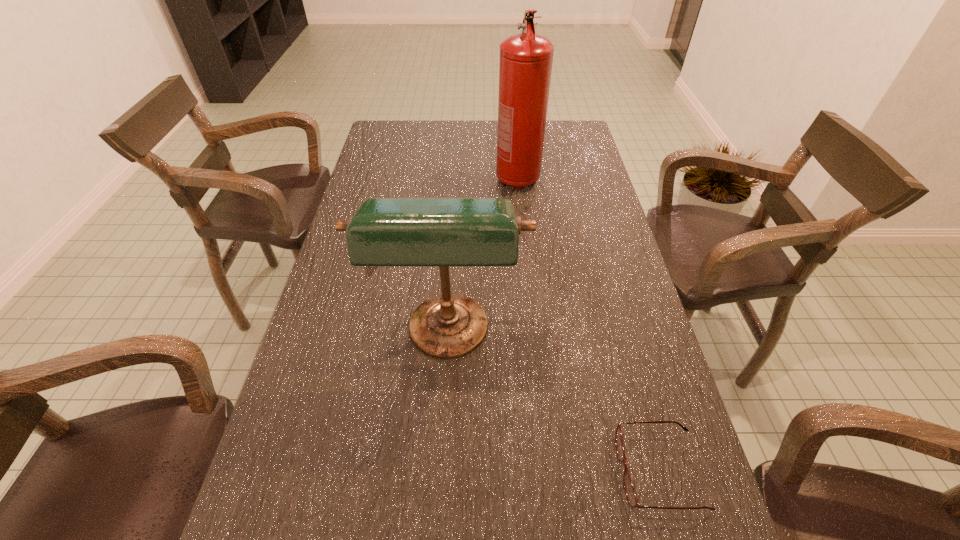
Find the location of a particular element. free location located 0.100m on the lenses of the nearest object is located at coordinates (566, 471).

What are the coordinates of `object that is positioned at the left edge` in the screenshot? It's located at (443, 232).

Find the location of `object located in the right edge section of the desktop`. object located in the right edge section of the desktop is located at coordinates (630, 492).

In the image, there is a desktop. Identify the location of vacant space at the far edge. Image resolution: width=960 pixels, height=540 pixels. (441, 144).

In the image, there is a desktop. Identify the location of free region at the left edge. (381, 185).

Locate an element on the screen. This screenshot has height=540, width=960. vacant space at the right edge is located at coordinates (683, 492).

Locate an element on the screen. vacant area between the second tallest object and the rightmost object is located at coordinates pyautogui.click(x=554, y=403).

The width and height of the screenshot is (960, 540). Identify the location of empty space that is in between the rightmost object and the second tallest object. (554, 403).

This screenshot has height=540, width=960. Find the location of `free space between the rightmost object and the table lamp`. free space between the rightmost object and the table lamp is located at coordinates (554, 403).

You are a GUI agent. You are given a task and a screenshot of the screen. Output one action in this format:
    pyautogui.click(x=<x>, y=<y>)
    Task: Click on the free space between the nearest object and the table lamp
    The height and width of the screenshot is (540, 960).
    Given the screenshot: What is the action you would take?
    pyautogui.click(x=554, y=403)